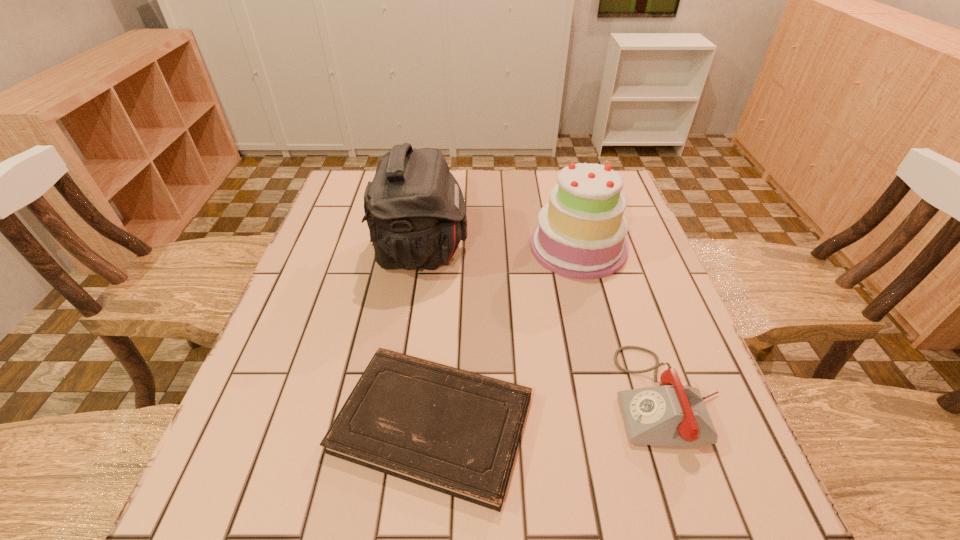
Where is `free spot that satisfies the following two spatial constraints: 1. on the back side of the shortest object; 2. on the right side of the third shortest object`? This screenshot has width=960, height=540. free spot that satisfies the following two spatial constraints: 1. on the back side of the shortest object; 2. on the right side of the third shortest object is located at coordinates (447, 247).

At what (x,y) coordinates should I click in order to perform the action: click on free space that satisfies the following two spatial constraints: 1. on the open flap of the paperback book; 2. on the right side of the tallest object. Please return your answer as a coordinate pair (x, y). This screenshot has width=960, height=540. Looking at the image, I should click on (395, 423).